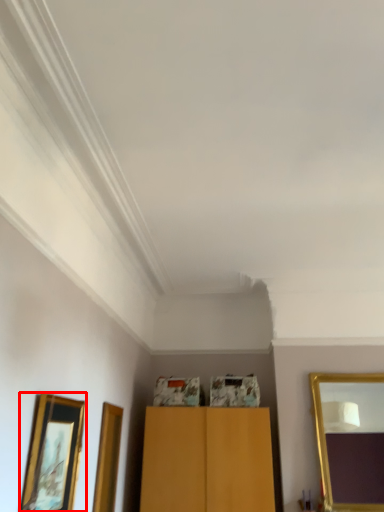
Question: Considering the relative positions of picture frame (annotated by the red box) and mirror in the image provided, where is picture frame (annotated by the red box) located with respect to the staircase?

Choices:
 (A) right
 (B) left

Answer: (B)